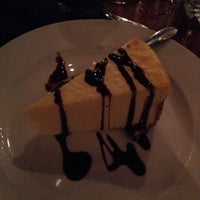
The image size is (200, 200). In order to click on sauce on plate in this screenshot , I will do `click(71, 167)`.